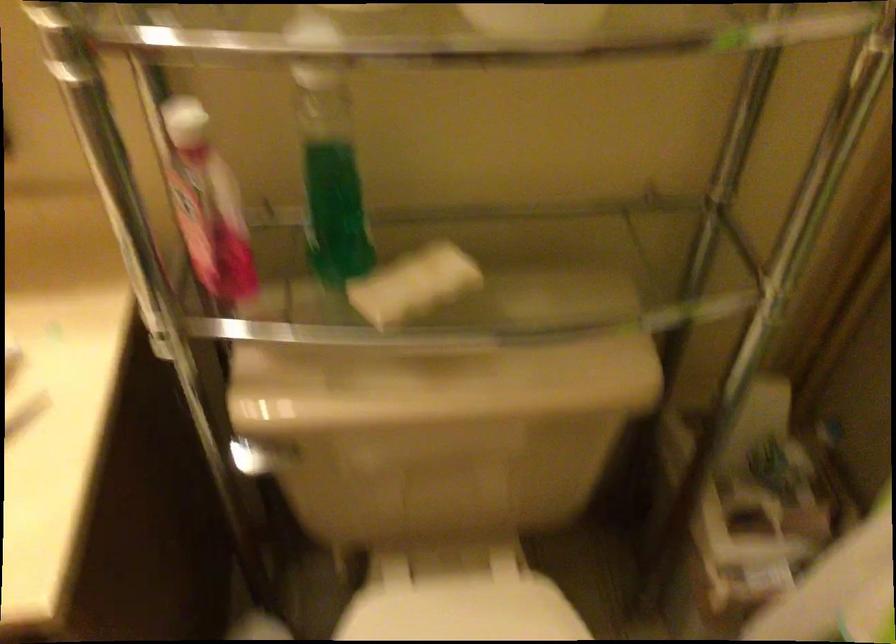
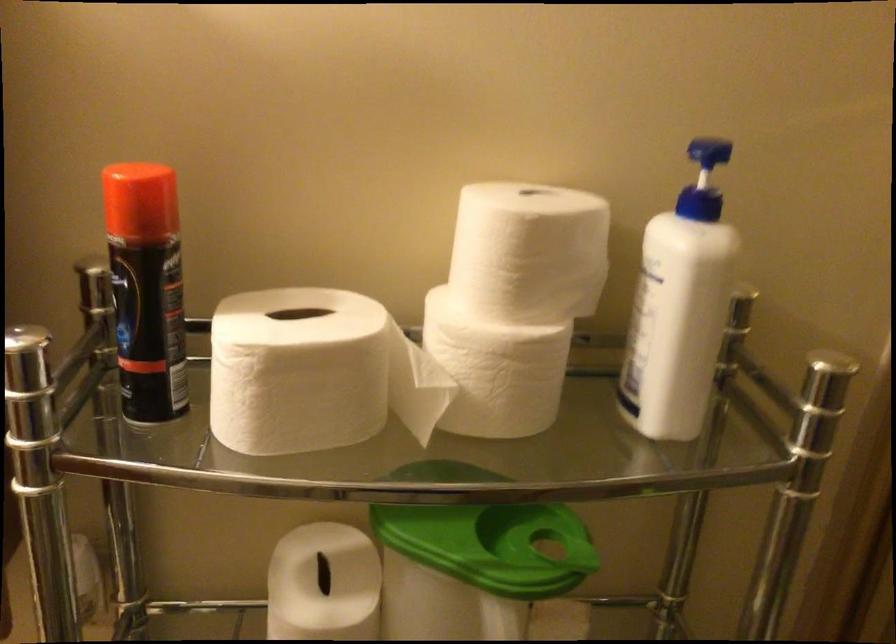
Question: Based on the continuous images, in which direction is the camera rotating? Reply with the corresponding letter.

Choices:
 (A) Left
 (B) Right
 (C) Up
 (D) Down

Answer: (C)